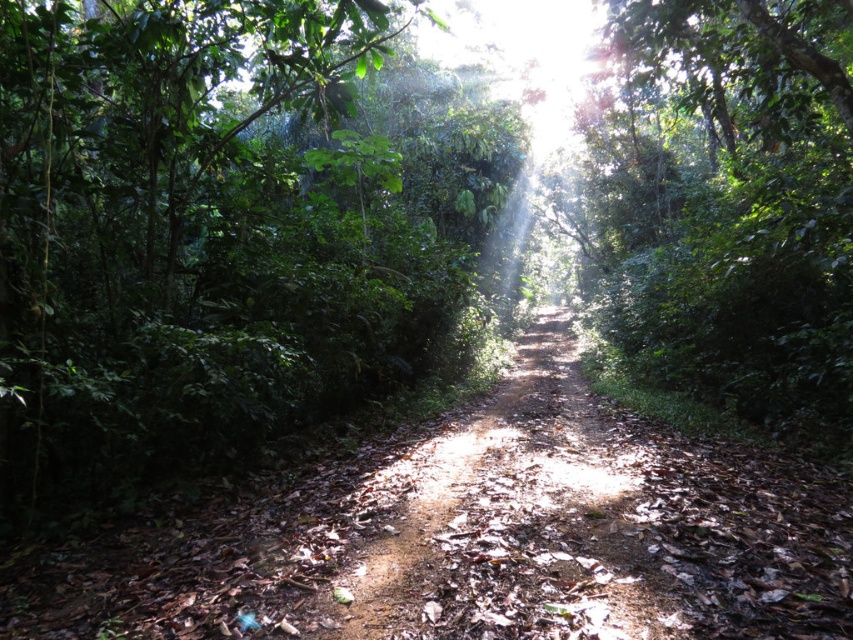
Question: Among these objects, which one is farthest from the camera?

Choices:
 (A) dirt path at center
 (B) green leafy tree at center

Answer: (B)

Question: Is the position of green leafy tree at center less distant than that of dirt path at center?

Choices:
 (A) yes
 (B) no

Answer: (B)

Question: Does green leafy tree at center have a lesser width compared to dirt path at center?

Choices:
 (A) yes
 (B) no

Answer: (B)

Question: Does green leafy tree at center appear under dirt path at center?

Choices:
 (A) no
 (B) yes

Answer: (A)